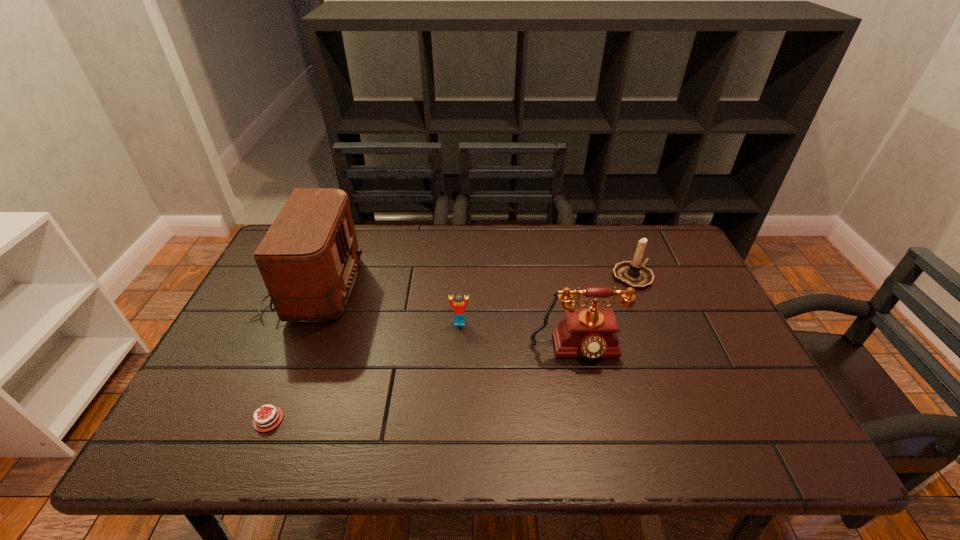
Image resolution: width=960 pixels, height=540 pixels. I want to click on object that is at the far left corner, so click(x=308, y=259).

Identify the location of object present at the near left corner. 271,416.

You are a GUI agent. You are given a task and a screenshot of the screen. Output one action in this format:
    pyautogui.click(x=<x>, y=<y>)
    Task: Click on the object located at the far right corner
    
    Given the screenshot: What is the action you would take?
    pyautogui.click(x=634, y=274)

What are the coordinates of `vacant space at the far edge of the desktop` in the screenshot? It's located at (484, 225).

Locate an element on the screen. free space at the near edge is located at coordinates (529, 455).

At what (x,y) coordinates should I click in order to perform the action: click on vacant area at the left edge of the desktop. Please return your answer as a coordinate pair (x, y). The image size is (960, 540). Looking at the image, I should click on 216,417.

At what (x,y) coordinates should I click in order to perform the action: click on unoccupied area between the chocolate cake and the third tallest object. Please return your answer as a coordinate pair (x, y). The width and height of the screenshot is (960, 540). Looking at the image, I should click on (450, 348).

The height and width of the screenshot is (540, 960). I want to click on free space between the fourth object from left to right and the tallest object, so click(x=444, y=319).

Image resolution: width=960 pixels, height=540 pixels. Identify the location of free space between the radio receiver and the third object from left to right. (386, 305).

At what (x,y) coordinates should I click in order to perform the action: click on vacant space that is in between the radio receiver and the nearest object. Please return your answer as a coordinate pair (x, y). This screenshot has height=540, width=960. Looking at the image, I should click on (290, 353).